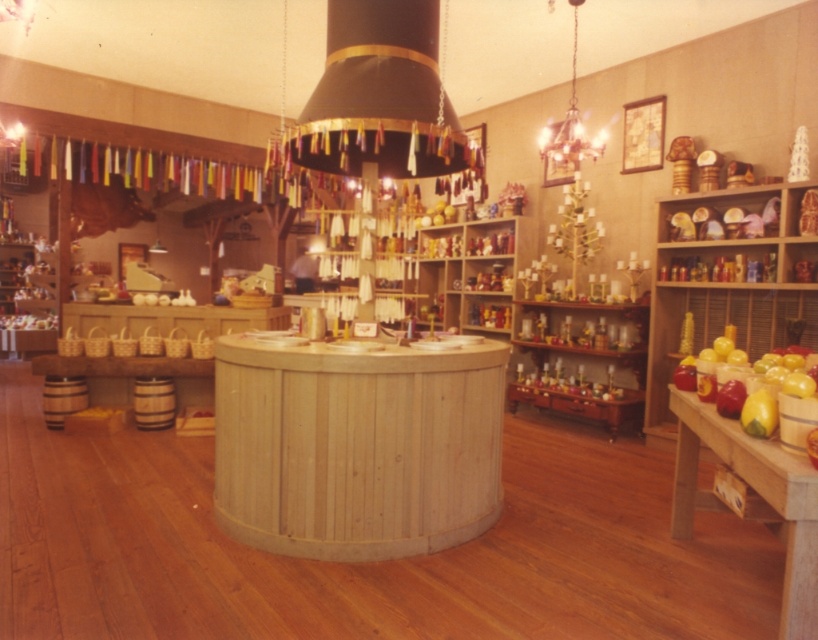
Question: Is natural wood table at center thinner than metallic chandelier at upper center?

Choices:
 (A) no
 (B) yes

Answer: (A)

Question: Can you confirm if natural wood table at center is wider than black fabric chandelier at upper center?

Choices:
 (A) yes
 (B) no

Answer: (A)

Question: Does natural wood table at center appear over black fabric chandelier at upper center?

Choices:
 (A) no
 (B) yes

Answer: (A)

Question: Based on their relative distances, which object is nearer to the metallic chandelier at upper center?

Choices:
 (A) wooden table at right
 (B) black fabric chandelier at upper center

Answer: (B)

Question: Which point appears closest to the camera in this image?

Choices:
 (A) pyautogui.click(x=690, y=496)
 (B) pyautogui.click(x=279, y=531)

Answer: (B)

Question: Among these objects, which one is nearest to the camera?

Choices:
 (A) metallic chandelier at upper center
 (B) black fabric chandelier at upper center

Answer: (B)